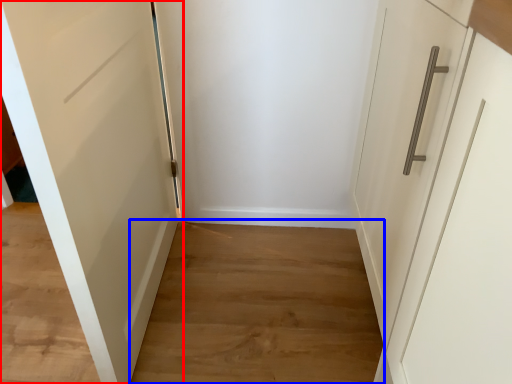
Question: Which object is closer to the camera taking this photo, door (highlighted by a red box) or path (highlighted by a blue box)?

Choices:
 (A) door
 (B) path

Answer: (A)